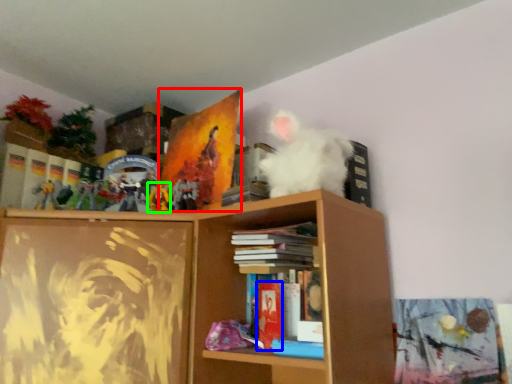
Question: Based on their relative distances, which object is nearer to paperback book (highlighted by a red box)? Choose from paperback book (highlighted by a blue box) and toy (highlighted by a green box).

Choices:
 (A) paperback book
 (B) toy

Answer: (B)